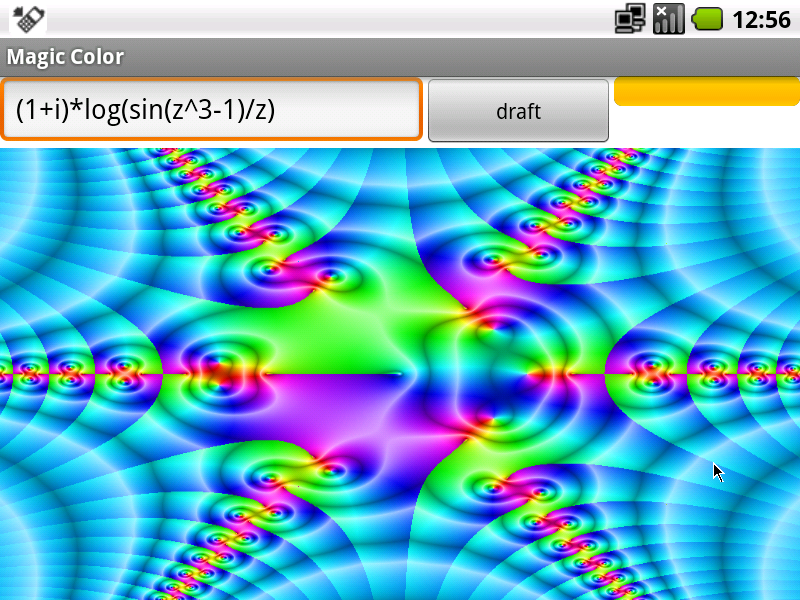
Locate an element on the screen. Image resolution: width=800 pixels, height=600 pixels. monitor is located at coordinates (622, 19), (642, 11).